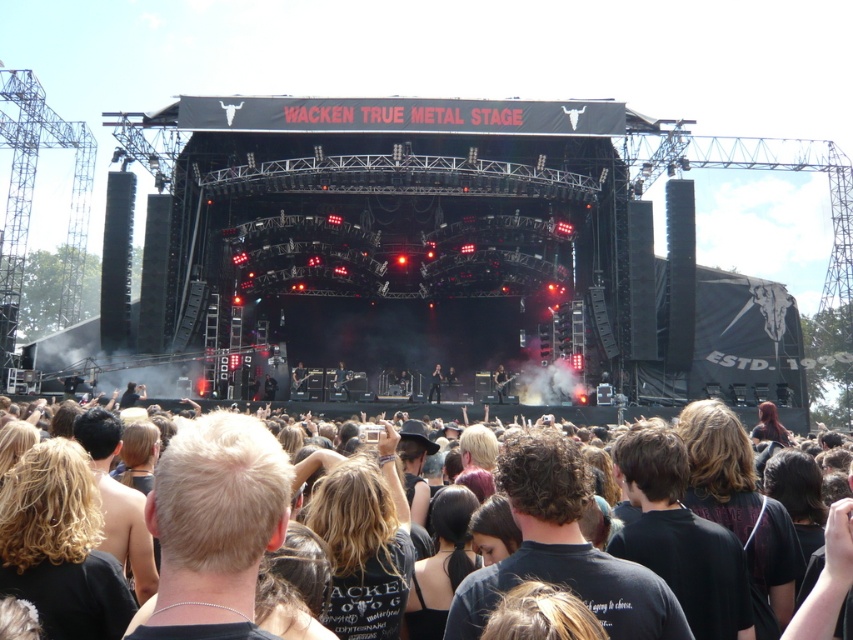
Is point (799, 620) positioned in front of point (503, 371)?

Yes, it is in front of point (503, 371).

Which is in front, point (834, 577) or point (498, 371)?

Point (834, 577) is more forward.

You are a GUI agent. You are given a task and a screenshot of the screen. Output one action in this format:
    pyautogui.click(x=<x>, y=<y>)
    Task: Click on the black fabric crowd at lower center
    This screenshot has height=640, width=853.
    Given the screenshot: What is the action you would take?
    pyautogui.click(x=827, y=579)

Measure the distance between black fabric crowd at lower center and camera.

They are 93.03 meters apart.

Is black fabric crowd at lower center smaller than shiny black guitar at center?

Incorrect, black fabric crowd at lower center is not smaller in size than shiny black guitar at center.

Which is in front, point (821, 579) or point (438, 403)?

Positioned in front is point (821, 579).

Locate an element on the screen. black fabric crowd at lower center is located at coordinates (827, 579).

Is dark brown leather jacket at center to the left of shiny black guitar at center from the viewer's perspective?

In fact, dark brown leather jacket at center is to the right of shiny black guitar at center.

Locate an element on the screen. Image resolution: width=853 pixels, height=640 pixels. dark brown leather jacket at center is located at coordinates (500, 381).

At what (x,y) coordinates should I click in order to perform the action: click on dark brown leather jacket at center. Please return your answer as a coordinate pair (x, y). This screenshot has height=640, width=853. Looking at the image, I should click on (500, 381).